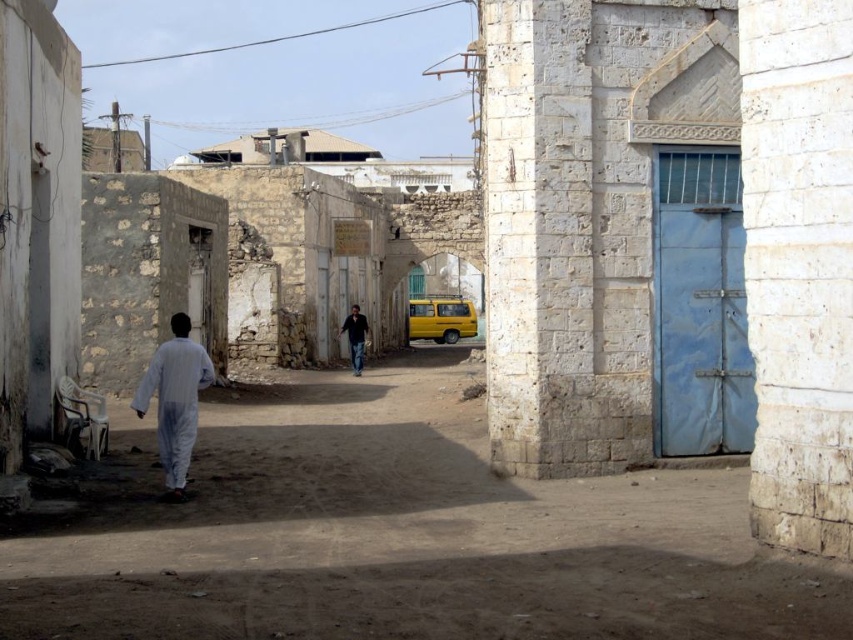
Question: Can you confirm if white stone alley at center is smaller than dark blue jeans at center?

Choices:
 (A) yes
 (B) no

Answer: (B)

Question: Which point is closer to the camera?

Choices:
 (A) dark blue jeans at center
 (B) white stone alley at center

Answer: (B)

Question: Is white matte clothing at left closer to the viewer compared to yellow matte school bus at center?

Choices:
 (A) no
 (B) yes

Answer: (B)

Question: Which point is closer to the camera taking this photo?

Choices:
 (A) (173, 387)
 (B) (471, 314)
 (C) (476, 502)

Answer: (A)

Question: Does white stone alley at center appear over white matte clothing at left?

Choices:
 (A) no
 (B) yes

Answer: (A)

Question: Among these objects, which one is nearest to the camera?

Choices:
 (A) white stone alley at center
 (B) yellow matte school bus at center

Answer: (A)